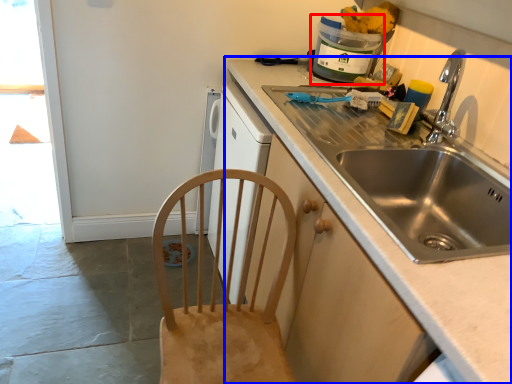
Question: Which object is further to the camera taking this photo, appliance (highlighted by a red box) or countertop (highlighted by a blue box)?

Choices:
 (A) appliance
 (B) countertop

Answer: (A)